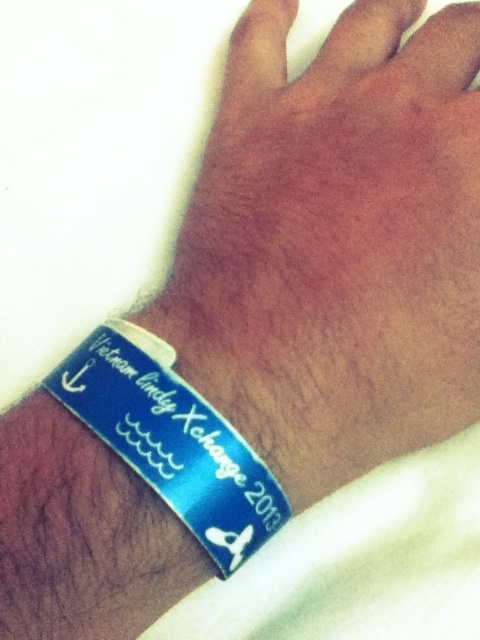
Question: Which point is farther to the camera?

Choices:
 (A) (369, 230)
 (B) (172, 458)

Answer: (A)

Question: Can you confirm if blue matte wristband at lower left is positioned above blue glossy wristband at lower left?

Choices:
 (A) no
 (B) yes

Answer: (B)

Question: Which object appears closest to the camera in this image?

Choices:
 (A) blue glossy wristband at lower left
 (B) blue matte wristband at lower left

Answer: (A)

Question: Is blue matte wristband at lower left positioned in front of blue glossy wristband at lower left?

Choices:
 (A) no
 (B) yes

Answer: (A)

Question: Does blue matte wristband at lower left have a greater width compared to blue glossy wristband at lower left?

Choices:
 (A) yes
 (B) no

Answer: (A)

Question: Which point is farther to the camera?

Choices:
 (A) blue matte wristband at lower left
 (B) blue glossy wristband at lower left

Answer: (A)